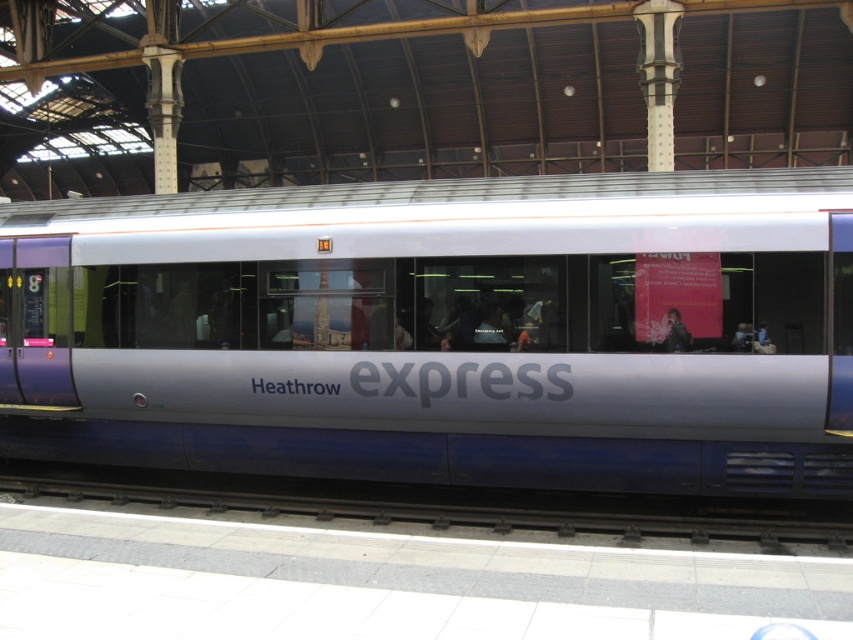
Question: Can you confirm if silver metallic train at center is thinner than black metal train track at lower center?

Choices:
 (A) no
 (B) yes

Answer: (B)

Question: Which point is closer to the camera?

Choices:
 (A) silver metallic train at center
 (B) black metal train track at lower center

Answer: (A)

Question: Is silver metallic train at center smaller than black metal train track at lower center?

Choices:
 (A) yes
 (B) no

Answer: (A)

Question: Among these objects, which one is farthest from the camera?

Choices:
 (A) silver metallic train at center
 (B) black metal train track at lower center

Answer: (B)

Question: Does silver metallic train at center have a smaller size compared to black metal train track at lower center?

Choices:
 (A) no
 (B) yes

Answer: (B)